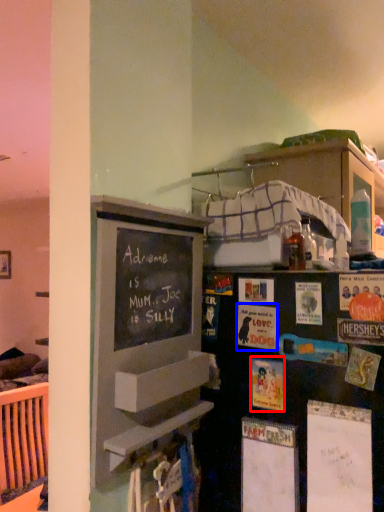
Question: Which object is closer to the camera taking this photo, postcard (highlighted by a red box) or postcard (highlighted by a blue box)?

Choices:
 (A) postcard
 (B) postcard

Answer: (A)